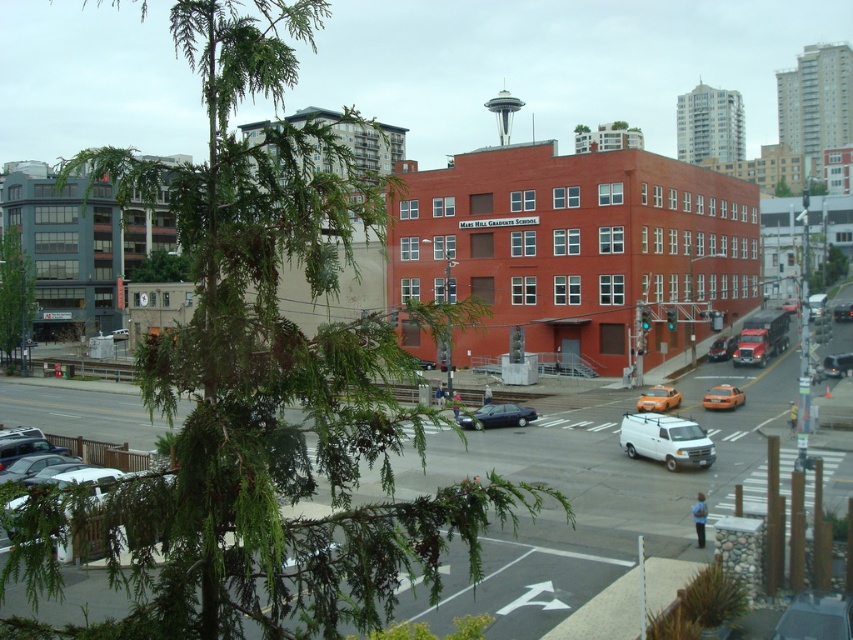
You are a delivery person trying to park your shiny black sedan at center near the green leafy tree at left. Given that the parking spot requires a minimum distance of 10 meters between vehicles, can you safely park your sedan there?

The green leafy tree at left is 62.97 meters away from the shiny black sedan at center. Since the required minimum distance is 10 meters, parking the sedan there would be safe as the distance is more than sufficient.

You are a city planner reviewing this urban layout. The green leafy tree at upper left is crucial for shading a new pedestrian walkway. Based on its current position, can you determine if the tree is positioned to cast shade over the walkway that runs along the street marked by white road lines and arrows?

The green leafy tree at upper left is located at coordinates point [260,387], which places it in the upper left area of the image. Since the walkway runs along the street with white road lines and arrows, the tree is positioned to cast shade over the walkway.